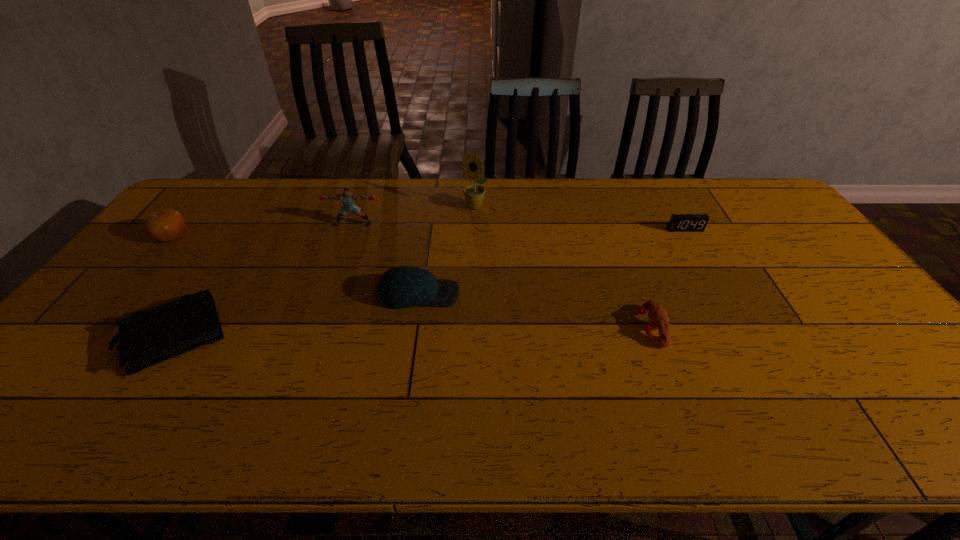
Identify the location of sunflower. (474, 194).

Image resolution: width=960 pixels, height=540 pixels. I want to click on the tallest object, so click(x=474, y=194).

Image resolution: width=960 pixels, height=540 pixels. In order to click on the sixth shortest object in this screenshot , I will do `click(348, 198)`.

At what (x,y) coordinates should I click in order to perform the action: click on the taller puncher. Please return your answer as a coordinate pair (x, y). This screenshot has height=540, width=960. Looking at the image, I should click on (348, 198).

The width and height of the screenshot is (960, 540). I want to click on clementine, so click(x=164, y=225).

Find the location of `baseball cap`. baseball cap is located at coordinates (403, 286).

Locate an element on the screen. the rightmost object is located at coordinates click(x=678, y=222).

Locate an element on the screen. Image resolution: width=960 pixels, height=540 pixels. Bible is located at coordinates (146, 338).

Identify the location of the right puncher. (658, 316).

You are a GUI agent. You are given a task and a screenshot of the screen. Output one action in this format:
    pyautogui.click(x=<x>, y=<y>)
    Task: Click on the second object from right to left
    
    Given the screenshot: What is the action you would take?
    pyautogui.click(x=658, y=316)